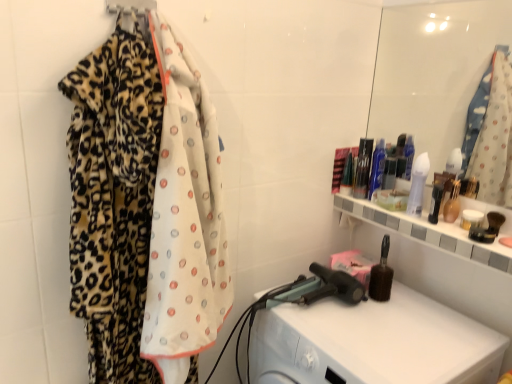
In order to click on translucent glass vase at upper right, the 2th toiletry when ordered from right to left in this screenshot , I will do `click(452, 203)`.

Identify the location of shiny plastic tube at upper right, which is the 7th toiletry from right to left. The height and width of the screenshot is (384, 512). (362, 168).

In order to face translucent plastic bottle at right, which is the sixth toiletry in left-to-right order, should I rotate leftwards or rightwards?

To face it directly, rotate right by 23.611 degrees.

Locate an element on the screen. The width and height of the screenshot is (512, 384). translucent glass vase at upper right, the 2th toiletry when ordered from right to left is located at coordinates click(452, 203).

Considering the relative positions of brown wooden brush at lower right, which is the third toiletry in left-to-right order, and white plastic washing machine at lower right in the image provided, is brown wooden brush at lower right, which is the third toiletry in left-to-right order, to the left or to the right of white plastic washing machine at lower right?

Clearly, brown wooden brush at lower right, which is the third toiletry in left-to-right order, is on the right of white plastic washing machine at lower right in the image.

Is brown wooden brush at lower right, which is the sixth toiletry from right to left, aimed at white plastic washing machine at lower right?

No, brown wooden brush at lower right, which is the sixth toiletry from right to left, is not aimed at white plastic washing machine at lower right.

Can you confirm if brown wooden brush at lower right, which is the sixth toiletry from right to left, is smaller than white plastic washing machine at lower right?

Correct, brown wooden brush at lower right, which is the sixth toiletry from right to left, occupies less space than white plastic washing machine at lower right.

Is brown wooden brush at lower right, which is the sixth toiletry from right to left, wider than white plastic washing machine at lower right?

In fact, brown wooden brush at lower right, which is the sixth toiletry from right to left, might be narrower than white plastic washing machine at lower right.

From a real-world perspective, which is physically above, leopard print fabric at upper left or green matte brush at upper right, the eighth toiletry when ordered from right to left?

In real-world perspective, leopard print fabric at upper left is above.

Which object is wider, leopard print fabric at upper left or green matte brush at upper right, arranged as the first toiletry when viewed from the left?

green matte brush at upper right, arranged as the first toiletry when viewed from the left.

Is green matte brush at upper right, the eighth toiletry when ordered from right to left, at the back of leopard print fabric at upper left?

No, leopard print fabric at upper left's orientation is not away from green matte brush at upper right, the eighth toiletry when ordered from right to left.

In the scene shown: In the image, is leopard print fabric at upper left on the left side or the right side of green matte brush at upper right, the eighth toiletry when ordered from right to left?

leopard print fabric at upper left is to the left of green matte brush at upper right, the eighth toiletry when ordered from right to left.

Is white glossy lotion at upper right, the 5th toiletry from the left, looking in the opposite direction of brown wooden brush at lower right, which is the sixth toiletry from right to left?

No.

Which is less distant, (412, 179) or (381, 295)?

Positioned in front is point (412, 179).

From the image's perspective, which one is positioned lower, white glossy lotion at upper right, the fourth toiletry from the right, or brown wooden brush at lower right, which is the sixth toiletry from right to left?

brown wooden brush at lower right, which is the sixth toiletry from right to left, from the image's perspective.

Measure the distance between white glossy lotion at upper right, the fourth toiletry from the right, and brown wooden brush at lower right, which is the third toiletry in left-to-right order.

The distance of white glossy lotion at upper right, the fourth toiletry from the right, from brown wooden brush at lower right, which is the third toiletry in left-to-right order, is 10.58 inches.

Is green matte brush at upper right, arranged as the first toiletry when viewed from the left, touching translucent glass vase at upper right, the 2th toiletry when ordered from right to left?

No, green matte brush at upper right, arranged as the first toiletry when viewed from the left, is not beside translucent glass vase at upper right, the 2th toiletry when ordered from right to left.

Is green matte brush at upper right, arranged as the first toiletry when viewed from the left, inside the boundaries of translucent glass vase at upper right, the 2th toiletry when ordered from right to left, or outside?

green matte brush at upper right, arranged as the first toiletry when viewed from the left, is not inside translucent glass vase at upper right, the 2th toiletry when ordered from right to left, it's outside.

Could you tell me if green matte brush at upper right, the eighth toiletry when ordered from right to left, is facing translucent glass vase at upper right, the 2th toiletry when ordered from right to left?

No, green matte brush at upper right, the eighth toiletry when ordered from right to left, is not turned towards translucent glass vase at upper right, the 2th toiletry when ordered from right to left.

Considering the relative sizes of shiny plastic tube at upper right, which is the 7th toiletry from right to left, and leopard print fabric at left in the image provided, is shiny plastic tube at upper right, which is the 7th toiletry from right to left, wider than leopard print fabric at left?

Incorrect, the width of shiny plastic tube at upper right, which is the 7th toiletry from right to left, does not surpass that of leopard print fabric at left.

Which is closer to the camera, (359, 155) or (194, 377)?

Point (359, 155) is positioned farther from the camera compared to point (194, 377).

Is shiny plastic tube at upper right, which is the 7th toiletry from right to left, further to camera compared to leopard print fabric at left?

Yes.

From the image's perspective, is shiny plastic tube at upper right, which ranks as the 2th toiletry in left-to-right order, over leopard print fabric at left?

Yes, from the image's perspective, shiny plastic tube at upper right, which ranks as the 2th toiletry in left-to-right order, is above leopard print fabric at left.

Is the depth of blue glossy bottle at upper right, marked as the 4th toiletry in a left-to-right arrangement, less than that of leopard print fabric at upper left?

No, the depth of blue glossy bottle at upper right, marked as the 4th toiletry in a left-to-right arrangement, is greater than that of leopard print fabric at upper left.

Based on the photo, is blue glossy bottle at upper right, arranged as the fifth toiletry when viewed from the right, turned away from leopard print fabric at upper left?

blue glossy bottle at upper right, arranged as the fifth toiletry when viewed from the right, does not have its back to leopard print fabric at upper left.

Is point (384, 160) positioned in front of point (115, 8)?

No.

Which of these two, blue glossy bottle at upper right, arranged as the fifth toiletry when viewed from the right, or leopard print fabric at upper left, stands taller?

blue glossy bottle at upper right, arranged as the fifth toiletry when viewed from the right, is taller.

Considering the positions of objects green matte brush at upper right, arranged as the first toiletry when viewed from the left, and leopard print fabric at upper left in the image provided, who is behind, green matte brush at upper right, arranged as the first toiletry when viewed from the left, or leopard print fabric at upper left?

green matte brush at upper right, arranged as the first toiletry when viewed from the left, is behind.

This screenshot has width=512, height=384. What are the coordinates of `hanger located above the green matte brush at upper right, the eighth toiletry when ordered from right to left (from the image's perspective)` in the screenshot? It's located at (130, 6).

Considering the relative sizes of green matte brush at upper right, arranged as the first toiletry when viewed from the left, and leopard print fabric at upper left in the image provided, is green matte brush at upper right, arranged as the first toiletry when viewed from the left, bigger than leopard print fabric at upper left?

Yes.

Is green matte brush at upper right, the eighth toiletry when ordered from right to left, spatially inside leopard print fabric at upper left, or outside of it?

green matte brush at upper right, the eighth toiletry when ordered from right to left, is not enclosed by leopard print fabric at upper left.

From a real-world perspective, count 1st toiletrys upward from the white plastic washing machine at lower right and point to it. Please provide its 2D coordinates.

[(381, 275)]

Which toiletry is the 8th one when counting from the back of the leopard print fabric at upper left? Please provide its 2D coordinates.

[(347, 175)]

Estimate the real-world distances between objects in this image. Which object is further from white glossy jar at upper right, which is the first toiletry from right to left, blue glossy bottle at upper right, marked as the 4th toiletry in a left-to-right arrangement, or translucent glass vase at upper right, the 2th toiletry when ordered from right to left?

blue glossy bottle at upper right, marked as the 4th toiletry in a left-to-right arrangement, is positioned further to the anchor white glossy jar at upper right, which is the first toiletry from right to left.

Estimate the real-world distances between objects in this image. Which object is closer to white glossy jar at upper right, which is the first toiletry from right to left, translucent glass vase at upper right, placed as the seventh toiletry when sorted from left to right, or shiny plastic tube at upper right, which ranks as the 2th toiletry in left-to-right order?

The object closer to white glossy jar at upper right, which is the first toiletry from right to left, is translucent glass vase at upper right, placed as the seventh toiletry when sorted from left to right.

Considering their positions, is leopard print fabric at left positioned further to shiny plastic tube at upper right, which ranks as the 2th toiletry in left-to-right order, than white glossy jar at upper right, which is the first toiletry from right to left?

leopard print fabric at left is further to shiny plastic tube at upper right, which ranks as the 2th toiletry in left-to-right order.

Considering their positions, is translucent glass vase at upper right, the 2th toiletry when ordered from right to left, positioned closer to green matte brush at upper right, the eighth toiletry when ordered from right to left, than white glossy lotion at upper right, the fourth toiletry from the right?

white glossy lotion at upper right, the fourth toiletry from the right, is positioned closer to the anchor green matte brush at upper right, the eighth toiletry when ordered from right to left.

Which object lies nearer to the anchor point white glossy lotion at upper right, the fourth toiletry from the right, blue glossy bottle at upper right, marked as the 4th toiletry in a left-to-right arrangement, or leopard print fabric at upper left?

The object closer to white glossy lotion at upper right, the fourth toiletry from the right, is blue glossy bottle at upper right, marked as the 4th toiletry in a left-to-right arrangement.

From the image, which object appears to be nearer to brown wooden brush at lower right, which is the third toiletry in left-to-right order, translucent plastic bottle at right, which is the sixth toiletry in left-to-right order, or blue glossy bottle at upper right, marked as the 4th toiletry in a left-to-right arrangement?

translucent plastic bottle at right, which is the sixth toiletry in left-to-right order.

When comparing their distances from white glossy jar at upper right, which is the first toiletry from right to left, does green matte brush at upper right, the eighth toiletry when ordered from right to left, or shiny plastic tube at upper right, which ranks as the 2th toiletry in left-to-right order, seem further?

green matte brush at upper right, the eighth toiletry when ordered from right to left, is positioned further to the anchor white glossy jar at upper right, which is the first toiletry from right to left.

Considering their positions, is shiny plastic tube at upper right, which ranks as the 2th toiletry in left-to-right order, positioned further to translucent glass vase at upper right, placed as the seventh toiletry when sorted from left to right, than brown wooden brush at lower right, which is the sixth toiletry from right to left?

shiny plastic tube at upper right, which ranks as the 2th toiletry in left-to-right order, is positioned further to the anchor translucent glass vase at upper right, placed as the seventh toiletry when sorted from left to right.

Identify the location of curtain between leopard print fabric at upper left and white plastic washing machine at lower right in the up-down direction. The image size is (512, 384). (145, 209).

At what (x,y) coordinates should I click in order to perform the action: click on washing machine located between leopard print fabric at left and white glossy jar at upper right, which is the first toiletry from right to left, in the left-right direction. Please return your answer as a coordinate pair (x, y). Image resolution: width=512 pixels, height=384 pixels. Looking at the image, I should click on (374, 343).

You are a GUI agent. You are given a task and a screenshot of the screen. Output one action in this format:
    pyautogui.click(x=<x>, y=<y>)
    Task: Click on the curtain between leopard print fabric at upper left and brown wooden brush at lower right, which is the sixth toiletry from right to left
    The height and width of the screenshot is (384, 512).
    Given the screenshot: What is the action you would take?
    pyautogui.click(x=145, y=209)

Where is `toiletry between white glossy jar at upper right, which is the first toiletry from right to left, and white plastic washing machine at lower right in the up-down direction`? toiletry between white glossy jar at upper right, which is the first toiletry from right to left, and white plastic washing machine at lower right in the up-down direction is located at coordinates (381, 275).